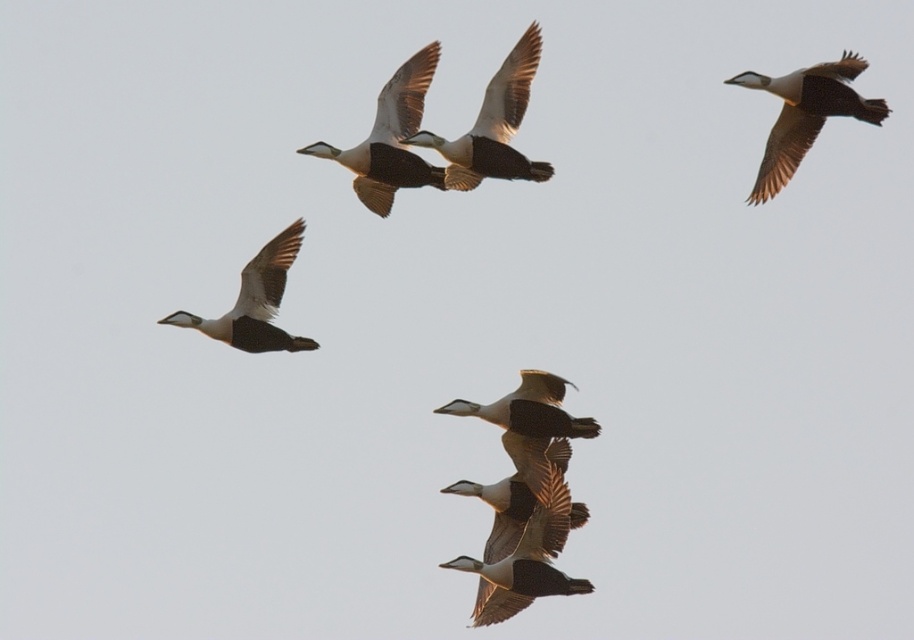
You are a birdwatcher observing the scene. You notice two white birds in the sky. Which one is bigger between the white glossy goose at upper center and the white glossy duck at center?

The white glossy goose at upper center is larger in size compared to the white glossy duck at center.

From the picture: You are a birdwatcher observing a flock of Eider ducks. You notice two distinct geese in the formation. The white glossy goose at upper center and the white matte goose at left. Which of these two geese is positioned to the right of the other?

The white glossy goose at upper center is positioned to the right of the white matte goose at left.

You are a birdwatcher observing the scene. You notice a white feathered duck at upper right marked by point (805,115). How would you describe its position relative to the other birds?

The white feathered duck at upper right marked by point (805,115) is positioned at the upper right corner of the scene, slightly ahead of the main flock formation.